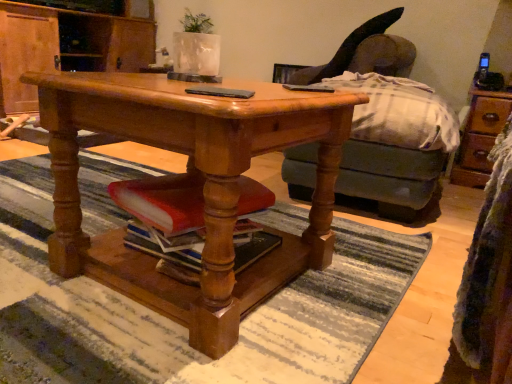
Question: Considering their positions, is wooden cabinet at center located in front of or behind velvet dark gray swivel chair at upper right?

Choices:
 (A) behind
 (B) front

Answer: (A)

Question: Visually, is wooden cabinet at center positioned to the left or to the right of velvet dark gray swivel chair at upper right?

Choices:
 (A) right
 (B) left

Answer: (B)

Question: Considering the real-world distances, which object is farthest from the velvet dark gray swivel chair at upper right?

Choices:
 (A) white textured vase at upper center
 (B) black matte phone at center
 (C) polished wood desk at center
 (D) wooden cabinet at center

Answer: (B)

Question: Estimate the real-world distances between objects in this image. Which object is closer to the polished wood desk at center?

Choices:
 (A) white textured vase at upper center
 (B) wooden cabinet at center
 (C) velvet dark gray swivel chair at upper right
 (D) black matte phone at center

Answer: (D)